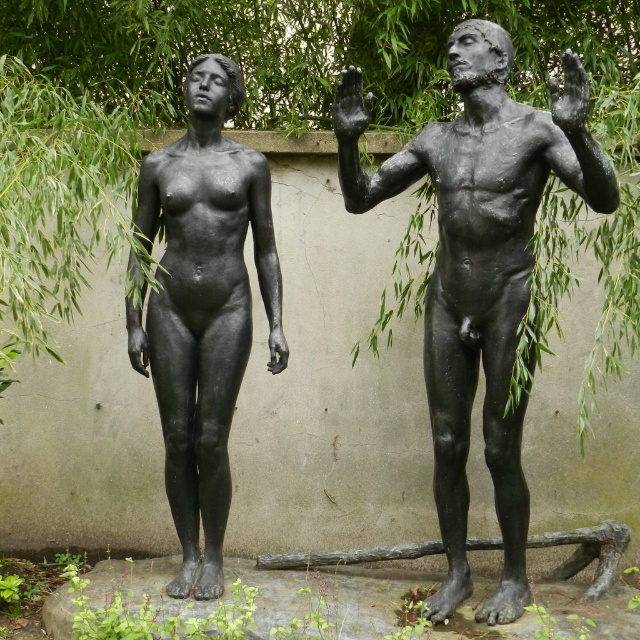
Does green leafy tree at upper left have a larger size compared to black matte hand at upper center?

Yes.

Is green leafy tree at upper left below black matte hand at upper center?

Incorrect, green leafy tree at upper left is not positioned below black matte hand at upper center.

Identify the location of green leafy tree at upper left. (292, 128).

Can you confirm if matte black statue at right is positioned to the right of black matte statue at center?

Indeed, matte black statue at right is positioned on the right side of black matte statue at center.

Which is behind, point (557, 99) or point (212, 132)?

Positioned behind is point (212, 132).

Locate an element on the screen. matte black statue at right is located at coordinates (483, 276).

Is green leafy tree at upper left taller than matte black statue at right?

No, green leafy tree at upper left is not taller than matte black statue at right.

Does green leafy tree at upper left have a lesser width compared to matte black statue at right?

Incorrect, green leafy tree at upper left's width is not less than matte black statue at right's.

Is point (548, 49) positioned in front of point (456, 353)?

No, it is not.

Find the location of a particular element. This screenshot has height=640, width=640. green leafy tree at upper left is located at coordinates (292, 128).